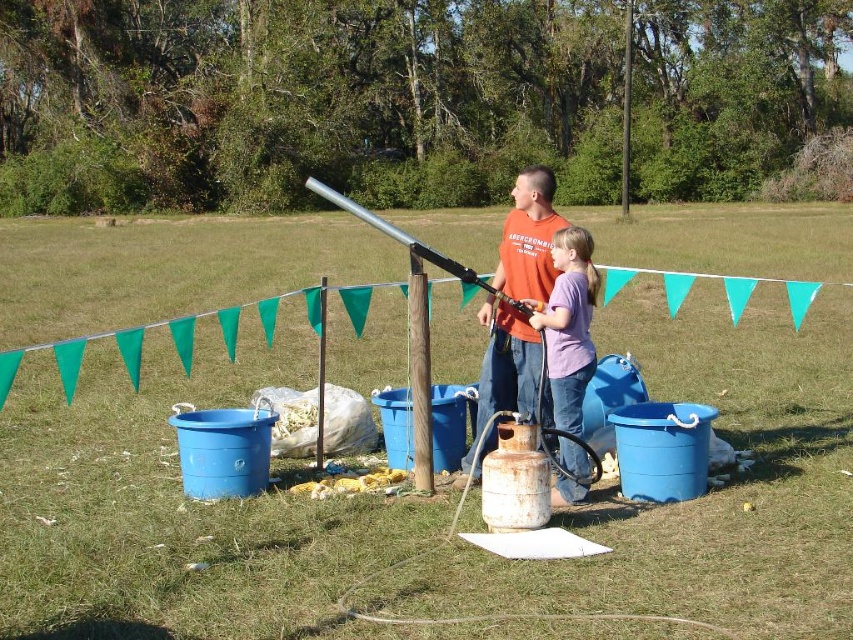
Is purple cotton shirt at center closer to the viewer compared to silver metallic rifle at center?

Yes, it is.

From the picture: Is purple cotton shirt at center thinner than silver metallic rifle at center?

Correct, purple cotton shirt at center's width is less than silver metallic rifle at center's.

Which is in front, point (566, 493) or point (521, 320)?

Point (566, 493) is more forward.

At what (x,y) coordinates should I click in order to perform the action: click on purple cotton shirt at center. Please return your answer as a coordinate pair (x, y). Looking at the image, I should click on (569, 353).

Between point (526, 204) and point (558, 296), which one is positioned in front?

Point (558, 296) is in front.

What are the coordinates of `orange cotton shirt at center` in the screenshot? It's located at (527, 237).

You are a GUI agent. You are given a task and a screenshot of the screen. Output one action in this format:
    pyautogui.click(x=<x>, y=<y>)
    Task: Click on the orange cotton shirt at center
    Image resolution: width=853 pixels, height=640 pixels.
    Given the screenshot: What is the action you would take?
    pyautogui.click(x=527, y=237)

Who is positioned more to the right, orange cotton shirt at center or silver metallic rifle at center?

From the viewer's perspective, orange cotton shirt at center appears more on the right side.

Measure the distance between orange cotton shirt at center and silver metallic rifle at center.

A distance of 6.08 meters exists between orange cotton shirt at center and silver metallic rifle at center.

Who is more distant from viewer, (485, 410) or (374, 225)?

The point (485, 410) is behind.

Identify the location of orange cotton shirt at center. (527, 237).